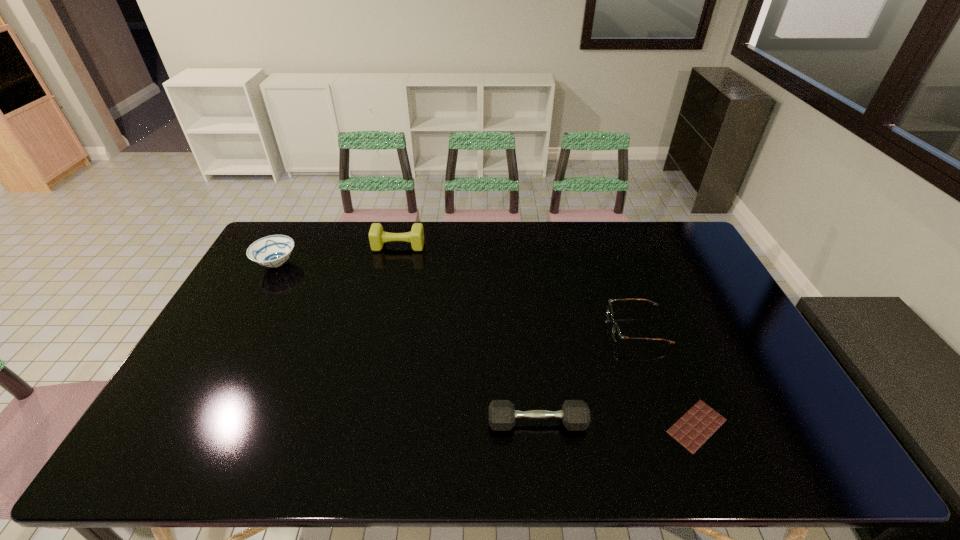
Where is `vacant position in the image that satisfies the following two spatial constraints: 1. on the front side of the farther dumbbell; 2. on the right side of the chocolate bar`? The width and height of the screenshot is (960, 540). vacant position in the image that satisfies the following two spatial constraints: 1. on the front side of the farther dumbbell; 2. on the right side of the chocolate bar is located at coordinates (357, 426).

Image resolution: width=960 pixels, height=540 pixels. In order to click on free space that satisfies the following two spatial constraints: 1. on the front-facing side of the third nearest object; 2. on the left side of the shortest object in this screenshot , I will do `click(671, 426)`.

Where is `free space that satisfies the following two spatial constraints: 1. on the front side of the nearer dumbbell; 2. on the left side of the chocolate bar`? free space that satisfies the following two spatial constraints: 1. on the front side of the nearer dumbbell; 2. on the left side of the chocolate bar is located at coordinates (538, 426).